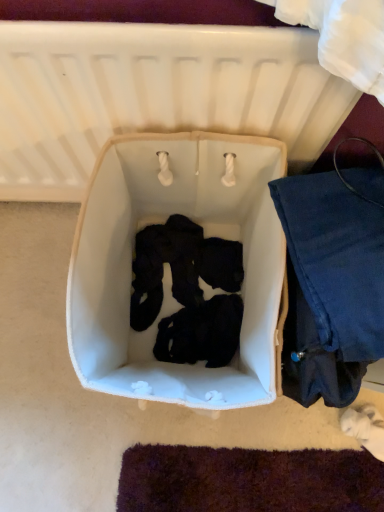
Question: Does white fabric laundry basket at center have a greater height compared to white fabric infant bed at center?

Choices:
 (A) yes
 (B) no

Answer: (B)

Question: Is white fabric laundry basket at center outside of white fabric infant bed at center?

Choices:
 (A) yes
 (B) no

Answer: (A)

Question: Can you confirm if white fabric laundry basket at center is positioned to the right of white fabric infant bed at center?

Choices:
 (A) no
 (B) yes

Answer: (B)

Question: Could you tell me if white fabric laundry basket at center is turned towards white fabric infant bed at center?

Choices:
 (A) no
 (B) yes

Answer: (A)

Question: Is white fabric laundry basket at center touching white fabric infant bed at center?

Choices:
 (A) yes
 (B) no

Answer: (B)

Question: From the image's perspective, would you say white fabric laundry basket at center is positioned over white fabric infant bed at center?

Choices:
 (A) no
 (B) yes

Answer: (A)

Question: Is white fabric infant bed at center at the back of denim fabric pants at right?

Choices:
 (A) yes
 (B) no

Answer: (A)

Question: Does denim fabric pants at right have a larger size compared to white fabric infant bed at center?

Choices:
 (A) no
 (B) yes

Answer: (B)

Question: Is denim fabric pants at right facing towards white fabric infant bed at center?

Choices:
 (A) no
 (B) yes

Answer: (A)

Question: Considering the relative positions of denim fabric pants at right and white fabric infant bed at center in the image provided, is denim fabric pants at right behind white fabric infant bed at center?

Choices:
 (A) yes
 (B) no

Answer: (A)

Question: Can you confirm if denim fabric pants at right is smaller than white fabric infant bed at center?

Choices:
 (A) yes
 (B) no

Answer: (B)

Question: Could white fabric infant bed at center be considered to be inside denim fabric pants at right?

Choices:
 (A) yes
 (B) no

Answer: (B)

Question: From the image's perspective, is white fabric infant bed at center above denim fabric pants at right?

Choices:
 (A) no
 (B) yes

Answer: (B)